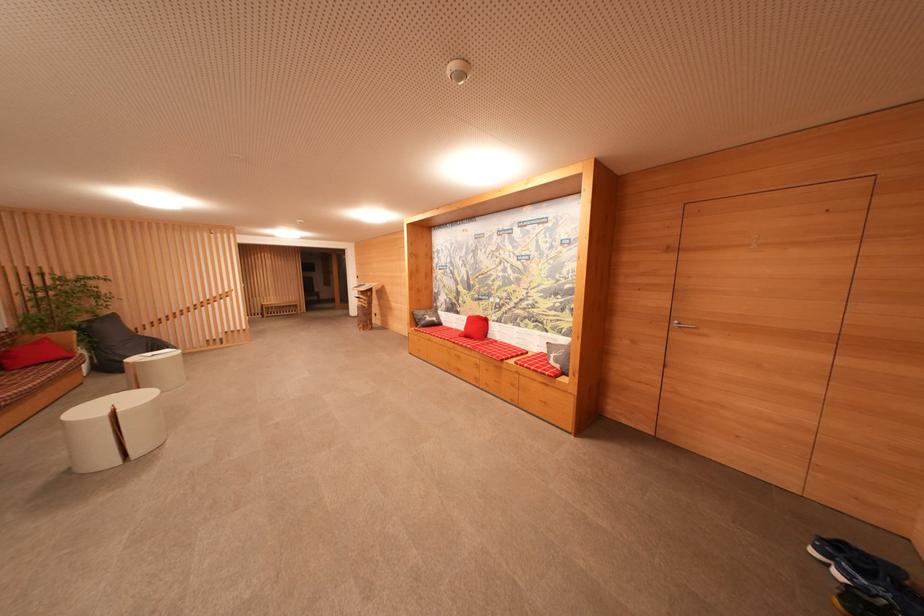
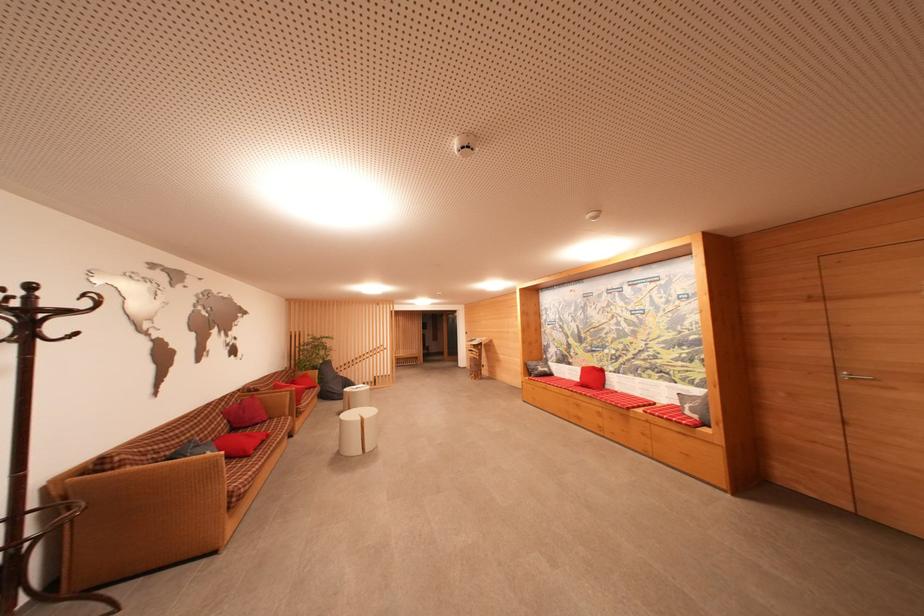
Question: How did the camera likely rotate?

Choices:
 (A) Left
 (B) Right
 (C) Up
 (D) Down

Answer: (A)